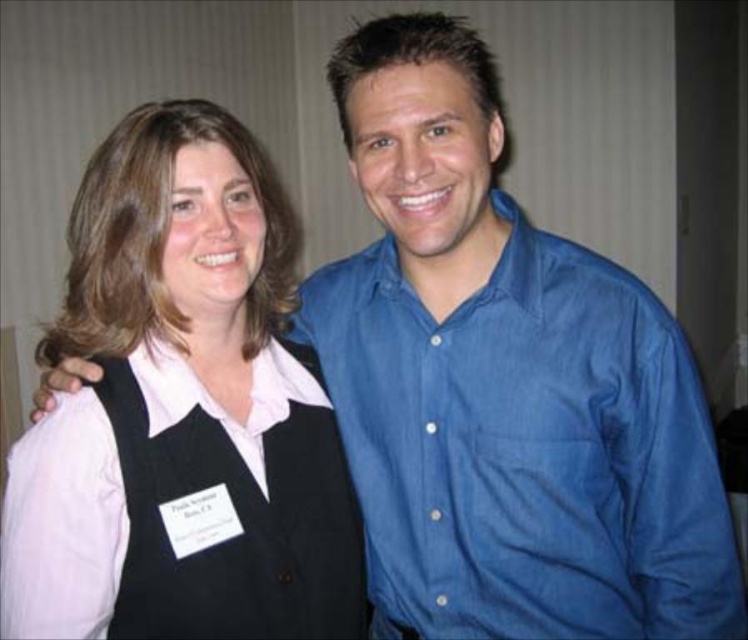
Is point (689, 355) positioned after point (141, 554)?

Yes, it is behind point (141, 554).

Is point (692, 435) positioned in front of point (292, 406)?

Yes, point (692, 435) is in front of point (292, 406).

The width and height of the screenshot is (748, 640). Find the location of `blue denim shirt at right`. blue denim shirt at right is located at coordinates (527, 449).

Consider the image. Which is below, black matte vest at center or blue denim shirt at right?

blue denim shirt at right

The width and height of the screenshot is (748, 640). Find the location of `black matte vest at center`. black matte vest at center is located at coordinates (180, 412).

Does point (98, 317) come behind point (162, 474)?

Yes, it is.

Which is in front, point (254, 548) or point (202, 620)?

Positioned in front is point (202, 620).

Does point (227, 218) come in front of point (331, 598)?

Yes, it is in front of point (331, 598).

The height and width of the screenshot is (640, 748). Identify the location of black matte vest at center. (180, 412).